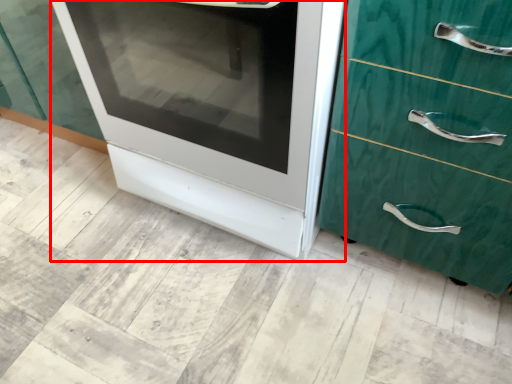
Question: From the image's perspective, where is oven (annotated by the red box) located relative to chest of drawers?

Choices:
 (A) below
 (B) above

Answer: (B)